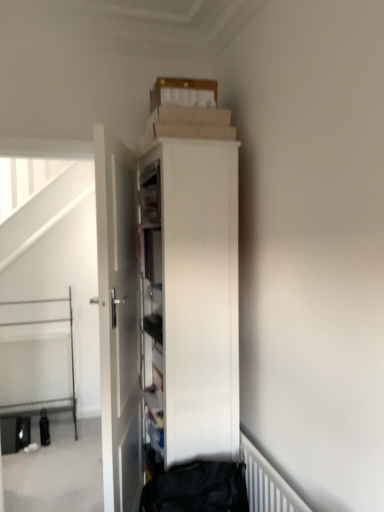
Locate an element on the screen. The height and width of the screenshot is (512, 384). vacant area in front of white metal bed at lower left is located at coordinates (45, 461).